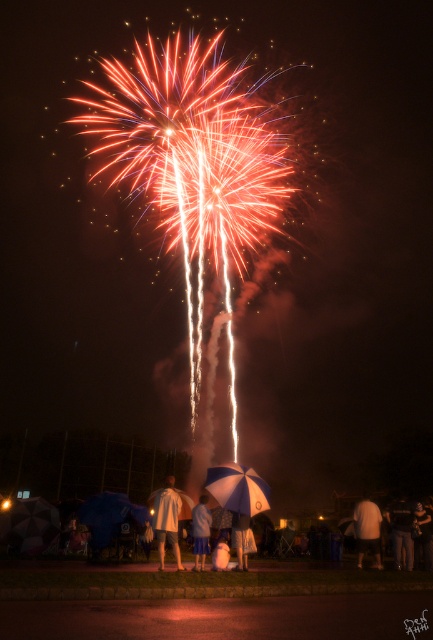
Question: Does blue matte umbrella at lower center appear on the right side of white cotton umbrella at center?

Choices:
 (A) yes
 (B) no

Answer: (A)

Question: Does jeans at lower right appear on the right side of white fabric umbrella at center?

Choices:
 (A) yes
 (B) no

Answer: (A)

Question: Considering the relative positions of geometric-patterned fabric umbrella at lower left and white matte shirt at center in the image provided, where is geometric-patterned fabric umbrella at lower left located with respect to white matte shirt at center?

Choices:
 (A) left
 (B) right

Answer: (A)

Question: Which point is farther to the camera?

Choices:
 (A) (430, 561)
 (B) (375, 520)

Answer: (A)

Question: Which object is the farthest from the jeans at lower right?

Choices:
 (A) blue matte umbrella at lower center
 (B) white cotton umbrella at center
 (C) white matte shirt at center
 (D) blue fabric umbrella at center

Answer: (D)

Question: Which object is positioned farthest from the jeans at lower right?

Choices:
 (A) dark blue fabric umbrella at center
 (B) blue matte umbrella at lower center
 (C) geometric-patterned fabric umbrella at lower left
 (D) white fabric umbrella at center

Answer: (C)